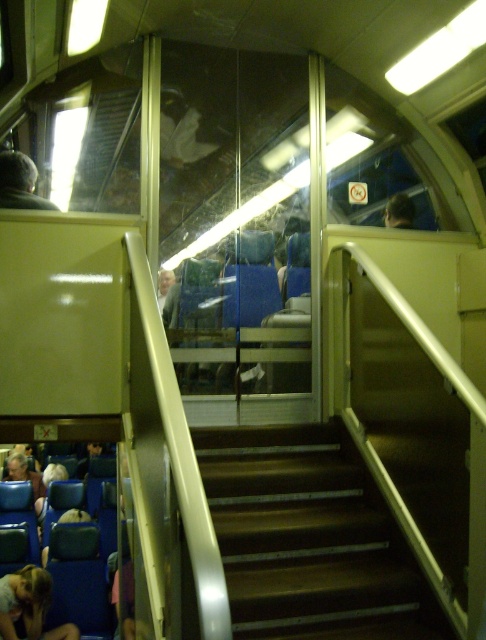
Question: Which object is farther from the camera taking this photo?

Choices:
 (A) metallic brown stairs at center
 (B) dark hair at upper left
 (C) light brown hair at upper center
 (D) light brown leather jacket at lower left

Answer: (D)

Question: Which point is farther to the camera?

Choices:
 (A) (267, 524)
 (B) (398, 220)
 (C) (53, 209)
 (D) (22, 604)

Answer: (D)

Question: Is the position of light brown hair at upper center more distant than that of light brown leather jacket at lower left?

Choices:
 (A) yes
 (B) no

Answer: (B)

Question: Can you confirm if dark hair at upper left is thinner than light brown leather jacket at lower left?

Choices:
 (A) no
 (B) yes

Answer: (B)

Question: Is light brown fabric person at lower left positioned behind light brown leather jacket at lower left?

Choices:
 (A) no
 (B) yes

Answer: (A)

Question: Which point is farther to the camera?

Choices:
 (A) light brown hair at upper center
 (B) light brown fabric person at lower left
 (C) dark hair at upper left

Answer: (A)